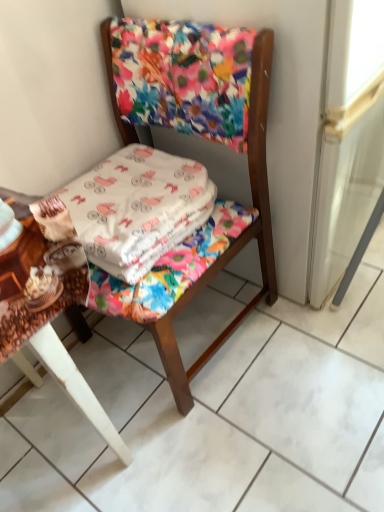
Where is `vacant region in front of wooden table at lower left`? vacant region in front of wooden table at lower left is located at coordinates (92, 482).